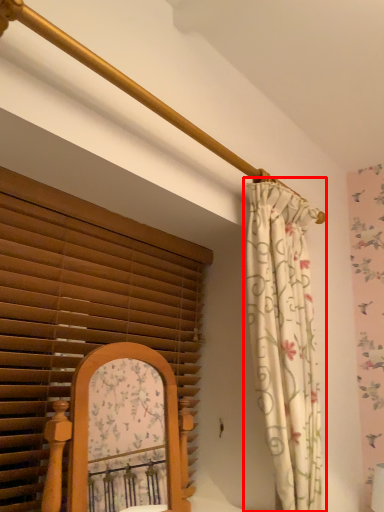
Question: From the image, what is the correct spatial relationship of curtain (annotated by the red box) in relation to window blind?

Choices:
 (A) left
 (B) right

Answer: (B)